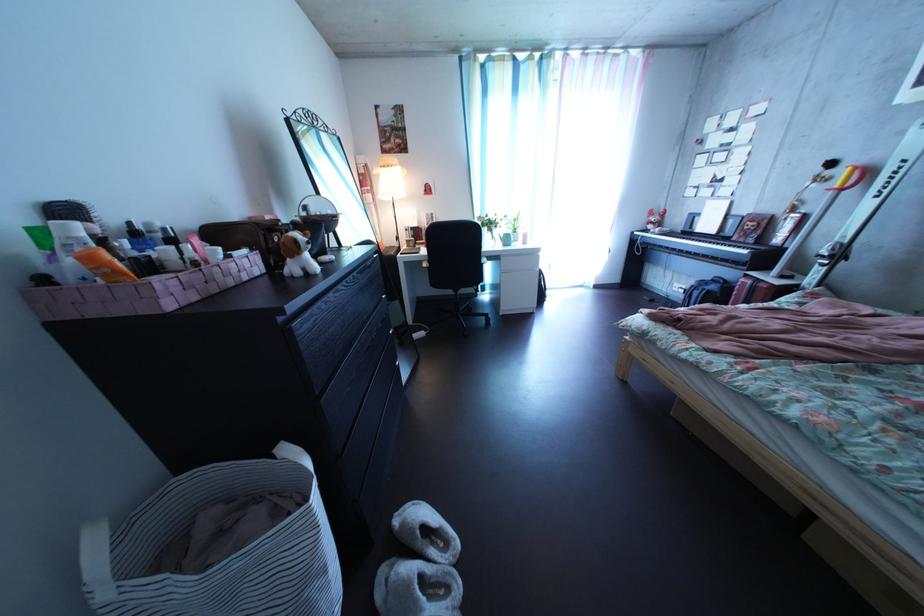
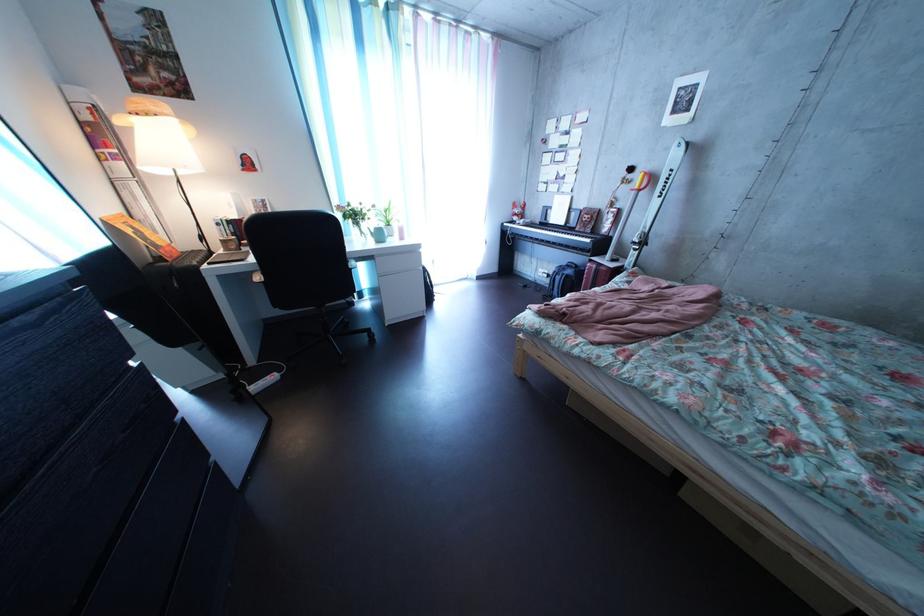
Locate, in the second image, the point that corresponds to (x=834, y=265) in the first image.

(648, 252)